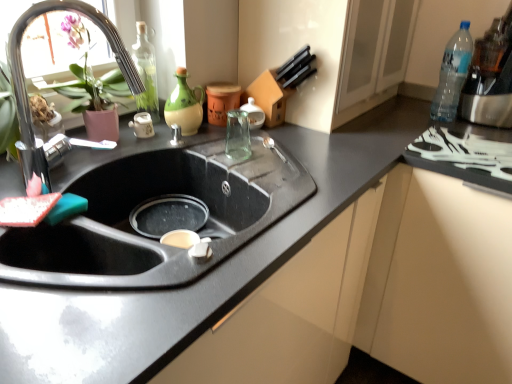
Question: Is green matte jug at upper center, which is the second bottle in left-to-right order, at the left side of clear plastic bottle at upper right, which is the third bottle in left-to-right order?

Choices:
 (A) no
 (B) yes

Answer: (B)

Question: Are green matte jug at upper center, which is the second bottle in left-to-right order, and clear plastic bottle at upper right, which is the third bottle in left-to-right order, located far from each other?

Choices:
 (A) yes
 (B) no

Answer: (B)

Question: Is green matte jug at upper center, which is the second bottle in left-to-right order, wider than clear plastic bottle at upper right, the first bottle viewed from the right?

Choices:
 (A) no
 (B) yes

Answer: (A)

Question: Is green matte jug at upper center, which is the second bottle in left-to-right order, behind clear plastic bottle at upper right, the first bottle viewed from the right?

Choices:
 (A) yes
 (B) no

Answer: (B)

Question: Would you say green matte jug at upper center, placed as the 2th bottle when sorted from right to left, contains clear plastic bottle at upper right, the first bottle viewed from the right?

Choices:
 (A) no
 (B) yes

Answer: (A)

Question: Considering the positions of point (143, 114) and point (475, 152), is point (143, 114) closer or farther from the camera than point (475, 152)?

Choices:
 (A) closer
 (B) farther

Answer: (B)

Question: Considering the positions of matte ceramic teapot at center and white plastic tray at right in the image, is matte ceramic teapot at center bigger or smaller than white plastic tray at right?

Choices:
 (A) small
 (B) big

Answer: (A)

Question: In the image, is matte ceramic teapot at center positioned in front of or behind white plastic tray at right?

Choices:
 (A) front
 (B) behind

Answer: (B)

Question: From a real-world perspective, is matte ceramic teapot at center physically located above or below white plastic tray at right?

Choices:
 (A) above
 (B) below

Answer: (A)

Question: Is white plastic tray at right wider or thinner than transparent glass bottle at upper left, which is the 1th bottle in left-to-right order?

Choices:
 (A) wide
 (B) thin

Answer: (A)

Question: Considering the positions of point (509, 175) and point (153, 52), is point (509, 175) closer or farther from the camera than point (153, 52)?

Choices:
 (A) farther
 (B) closer

Answer: (B)

Question: From a real-world perspective, is white plastic tray at right positioned above or below transparent glass bottle at upper left, placed as the third bottle when sorted from right to left?

Choices:
 (A) above
 (B) below

Answer: (B)

Question: Do you think white plastic tray at right is within transparent glass bottle at upper left, which is the 1th bottle in left-to-right order, or outside of it?

Choices:
 (A) outside
 (B) inside

Answer: (A)

Question: Looking at their shapes, would you say green matte jug at upper center, which is the second bottle in left-to-right order, is wider or thinner than clear plastic bottle at upper right, which is the third bottle in left-to-right order?

Choices:
 (A) wide
 (B) thin

Answer: (B)

Question: Looking at the image, does green matte jug at upper center, placed as the 2th bottle when sorted from right to left, seem bigger or smaller compared to clear plastic bottle at upper right, which is the third bottle in left-to-right order?

Choices:
 (A) small
 (B) big

Answer: (A)